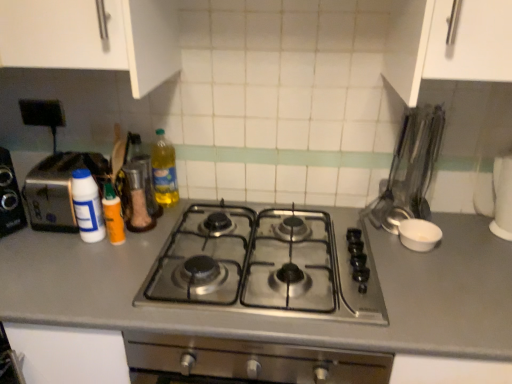
Locate an element on the screen. Image resolution: width=512 pixels, height=384 pixels. vacant space behind white matte bowl at right, the first appliance ordered from the bottom is located at coordinates (402, 214).